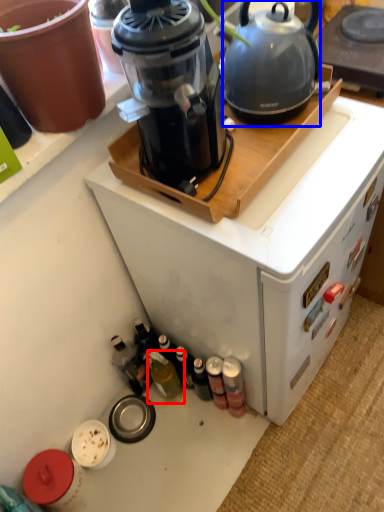
Question: Which object appears closest to the camera in this image, bottle (highlighted by a red box) or kettle (highlighted by a blue box)?

Choices:
 (A) bottle
 (B) kettle

Answer: (B)